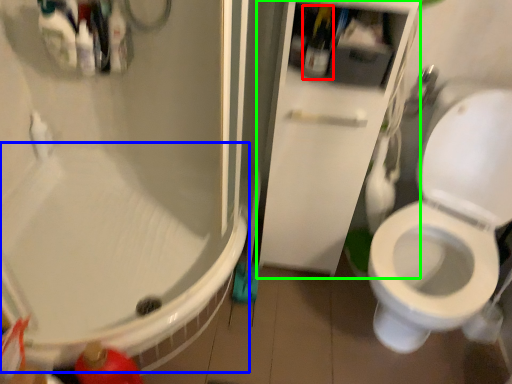
Question: Based on their relative distances, which object is farther from bottle (highlighted by a red box)? Choose from bath (highlighted by a blue box) and screen door (highlighted by a green box).

Choices:
 (A) bath
 (B) screen door

Answer: (A)